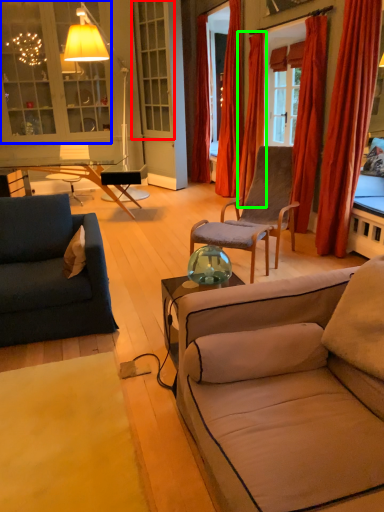
Question: Based on their relative distances, which object is nearer to window (highlighted by a red box)? Choose from cabinetry (highlighted by a blue box) and curtain (highlighted by a green box).

Choices:
 (A) cabinetry
 (B) curtain

Answer: (A)